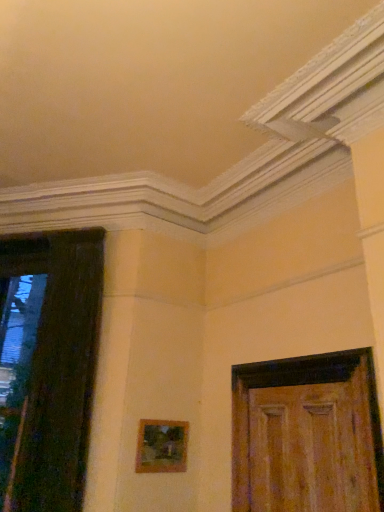
Image resolution: width=384 pixels, height=512 pixels. I want to click on wooden door at right, the second door viewed from the left, so click(x=307, y=435).

Locate an element on the screen. This screenshot has height=512, width=384. wooden frame at center is located at coordinates (161, 446).

Could you tell me if dark wood door at left, acting as the 2th door starting from the right, is facing wooden frame at center?

No, dark wood door at left, acting as the 2th door starting from the right, is not oriented towards wooden frame at center.

At what (x,y) coordinates should I click in order to perform the action: click on picture frame on the right of dark wood door at left, acting as the 2th door starting from the right. Please return your answer as a coordinate pair (x, y). This screenshot has height=512, width=384. Looking at the image, I should click on (161, 446).

From the image's perspective, which is below, dark wood door at left, acting as the 2th door starting from the right, or wooden frame at center?

From the image's view, wooden frame at center is below.

Which object is wider, dark wood door at left, acting as the 2th door starting from the right, or wooden frame at center?

dark wood door at left, acting as the 2th door starting from the right.

The width and height of the screenshot is (384, 512). Find the location of `the 2nd door in front of the wooden frame at center, starting your count from the anchor`. the 2nd door in front of the wooden frame at center, starting your count from the anchor is located at coordinates (307, 435).

How distant is wooden door at right, the second door viewed from the left, from wooden frame at center?

They are 35.58 inches apart.

Is wooden door at right, which is the first door from right to left, smaller than wooden frame at center?

Incorrect, wooden door at right, which is the first door from right to left, is not smaller in size than wooden frame at center.

Is wooden door at right, the second door viewed from the left, not near wooden frame at center?

Actually, wooden door at right, the second door viewed from the left, and wooden frame at center are a little close together.

Can you tell me how much dark wood door at left, which is counted as the 1th door, starting from the left, and wooden door at right, the second door viewed from the left, differ in facing direction?

The angular difference between dark wood door at left, which is counted as the 1th door, starting from the left, and wooden door at right, the second door viewed from the left, is 37.3 degrees.

Which object is positioned more to the left, dark wood door at left, acting as the 2th door starting from the right, or wooden door at right, which is the first door from right to left?

dark wood door at left, acting as the 2th door starting from the right.

How much distance is there between dark wood door at left, which is counted as the 1th door, starting from the left, and wooden door at right, which is the first door from right to left?

They are 1.54 meters apart.

Considering the sizes of objects dark wood door at left, which is counted as the 1th door, starting from the left, and wooden door at right, the second door viewed from the left, in the image provided, who is bigger, dark wood door at left, which is counted as the 1th door, starting from the left, or wooden door at right, the second door viewed from the left,?

Bigger between the two is dark wood door at left, which is counted as the 1th door, starting from the left.

Is wooden door at right, which is the first door from right to left, situated inside dark wood door at left, which is counted as the 1th door, starting from the left, or outside?

wooden door at right, which is the first door from right to left, is not inside dark wood door at left, which is counted as the 1th door, starting from the left, it's outside.

From the image's perspective, does wooden door at right, which is the first door from right to left, appear lower than dark wood door at left, acting as the 2th door starting from the right?

Yes, from the image's perspective, wooden door at right, which is the first door from right to left, is beneath dark wood door at left, acting as the 2th door starting from the right.

Who is smaller, wooden door at right, which is the first door from right to left, or dark wood door at left, acting as the 2th door starting from the right?

With smaller size is wooden door at right, which is the first door from right to left.

Which object is further away from the camera, wooden frame at center or wooden door at right, the second door viewed from the left?

Positioned behind is wooden frame at center.

Is wooden frame at center bigger than wooden door at right, which is the first door from right to left?

Incorrect, wooden frame at center is not larger than wooden door at right, which is the first door from right to left.

Is wooden frame at center located outside wooden door at right, which is the first door from right to left?

wooden frame at center is positioned outside wooden door at right, which is the first door from right to left.

From the image's perspective, which one is positioned higher, wooden frame at center or wooden door at right, which is the first door from right to left?

wooden door at right, which is the first door from right to left.

Can you confirm if wooden frame at center is shorter than dark wood door at left, acting as the 2th door starting from the right?

Indeed, wooden frame at center has a lesser height compared to dark wood door at left, acting as the 2th door starting from the right.

Is wooden frame at center oriented away from dark wood door at left, acting as the 2th door starting from the right?

That's not correct — wooden frame at center is not looking away from dark wood door at left, acting as the 2th door starting from the right.

Is point (150, 421) farther from camera compared to point (63, 267)?

No, (150, 421) is in front of (63, 267).

Could dark wood door at left, which is counted as the 1th door, starting from the left, be considered to be inside wooden frame at center?

Actually, dark wood door at left, which is counted as the 1th door, starting from the left, is outside wooden frame at center.

From a real-world perspective, count 2nd doors upward from the wooden frame at center and point to it. Please provide its 2D coordinates.

[(47, 366)]

Locate an element on the screen. the 1st door positioned above the wooden frame at center (from the image's perspective) is located at coordinates (307, 435).

From the image, which object appears to be farther from wooden frame at center, wooden door at right, the second door viewed from the left, or dark wood door at left, acting as the 2th door starting from the right?

Based on the image, wooden door at right, the second door viewed from the left, appears to be further to wooden frame at center.

Based on the photo, based on their spatial positions, is dark wood door at left, which is counted as the 1th door, starting from the left, or wooden door at right, the second door viewed from the left, further from wooden frame at center?

Based on the image, wooden door at right, the second door viewed from the left, appears to be further to wooden frame at center.

Which object lies nearer to the anchor point wooden door at right, which is the first door from right to left, dark wood door at left, acting as the 2th door starting from the right, or wooden frame at center?

wooden frame at center lies closer to wooden door at right, which is the first door from right to left, than the other object.

Based on their spatial positions, is wooden frame at center or wooden door at right, which is the first door from right to left, further from dark wood door at left, which is counted as the 1th door, starting from the left?

wooden door at right, which is the first door from right to left, lies further to dark wood door at left, which is counted as the 1th door, starting from the left, than the other object.

Based on their spatial positions, is wooden door at right, which is the first door from right to left, or wooden frame at center further from dark wood door at left, acting as the 2th door starting from the right?

Based on the image, wooden door at right, which is the first door from right to left, appears to be further to dark wood door at left, acting as the 2th door starting from the right.

When comparing their distances from wooden door at right, which is the first door from right to left, does wooden frame at center or dark wood door at left, which is counted as the 1th door, starting from the left, seem further?

The object further to wooden door at right, which is the first door from right to left, is dark wood door at left, which is counted as the 1th door, starting from the left.

Identify the location of picture frame located between dark wood door at left, which is counted as the 1th door, starting from the left, and wooden door at right, the second door viewed from the left, in the left-right direction. (161, 446).